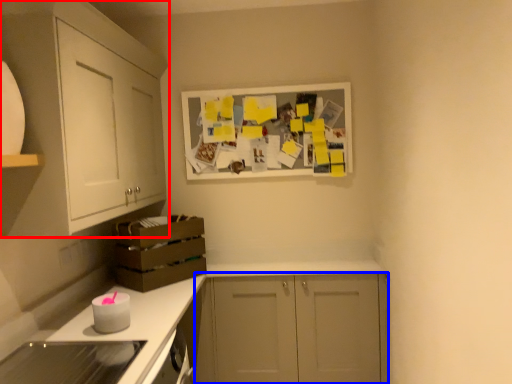
Question: Which object appears farthest to the camera in this image, cabinetry (highlighted by a red box) or cabinetry (highlighted by a blue box)?

Choices:
 (A) cabinetry
 (B) cabinetry

Answer: (B)